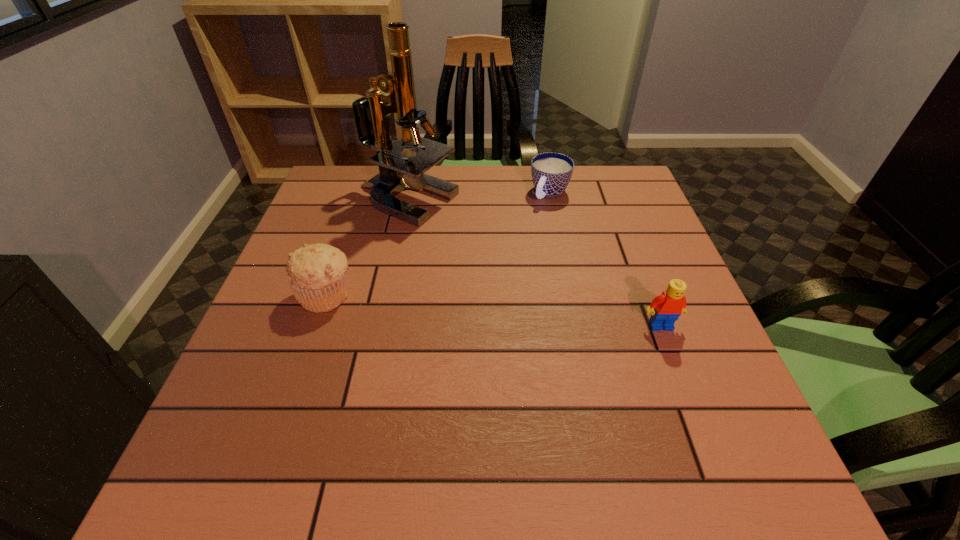
The width and height of the screenshot is (960, 540). What are the coordinates of `free point located 0.260m on the side of the cup with the handle` in the screenshot? It's located at (x=501, y=263).

Where is `vacant region located 0.380m at the eyepiece of the tallest object`? This screenshot has width=960, height=540. vacant region located 0.380m at the eyepiece of the tallest object is located at coordinates (524, 313).

Where is `free space located at the eyepiece of the tallest object`? The image size is (960, 540). free space located at the eyepiece of the tallest object is located at coordinates (445, 234).

You are a GUI agent. You are given a task and a screenshot of the screen. Output one action in this format:
    pyautogui.click(x=<x>, y=<y>)
    Task: Click on the vacant space situated at the eyepiece of the tallest object
    This screenshot has height=540, width=960.
    Given the screenshot: What is the action you would take?
    pyautogui.click(x=487, y=275)

Locate an element on the screen. This screenshot has height=540, width=960. cup situated at the far edge is located at coordinates (551, 172).

Locate an element on the screen. The height and width of the screenshot is (540, 960). microscope located at the far edge is located at coordinates (397, 172).

This screenshot has width=960, height=540. In order to click on muffin that is at the left edge in this screenshot , I will do `click(317, 273)`.

At what (x,y) coordinates should I click in order to perform the action: click on microscope positioned at the left edge. Please return your answer as a coordinate pair (x, y). Looking at the image, I should click on pyautogui.click(x=397, y=172).

Find the location of a particular element. This screenshot has height=540, width=960. object located at the right edge is located at coordinates (665, 309).

You are a GUI agent. You are given a task and a screenshot of the screen. Output one action in this format:
    pyautogui.click(x=<x>, y=<y>)
    Task: Click on the object at the far left corner
    
    Given the screenshot: What is the action you would take?
    pyautogui.click(x=397, y=172)